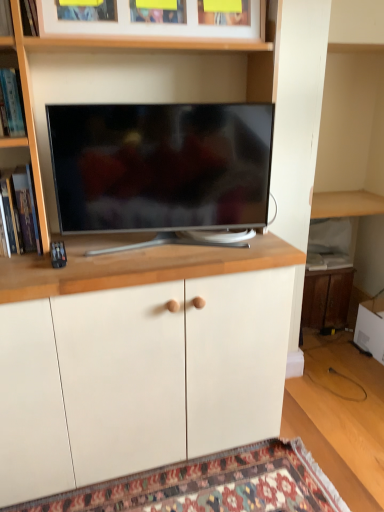
Locate an element on the screen. unoccupied area in front of wooden cabinet at lower right, which is the second cabinetry from front to back is located at coordinates tap(331, 346).